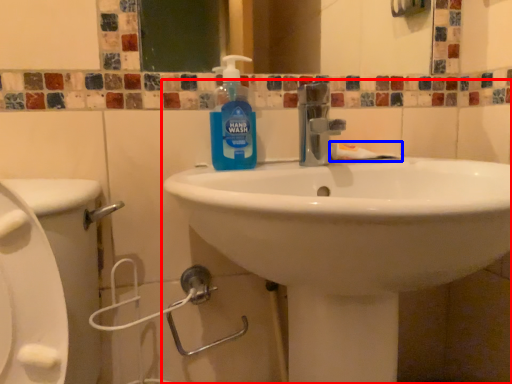
Question: Which object appears closest to the camera in this image, sink (highlighted by a red box) or toothpaste (highlighted by a blue box)?

Choices:
 (A) sink
 (B) toothpaste

Answer: (A)